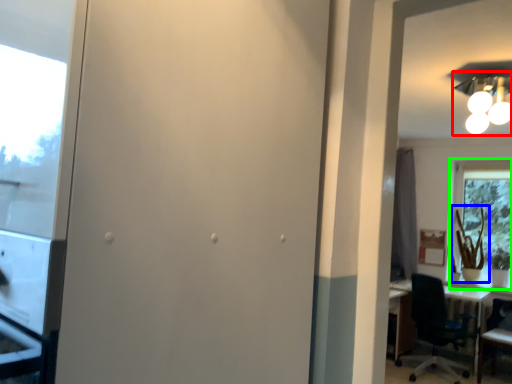
Question: Based on their relative distances, which object is farther from light fixture (highlighted by a red box)? Choose from plant (highlighted by a blue box) and window (highlighted by a green box).

Choices:
 (A) plant
 (B) window

Answer: (A)